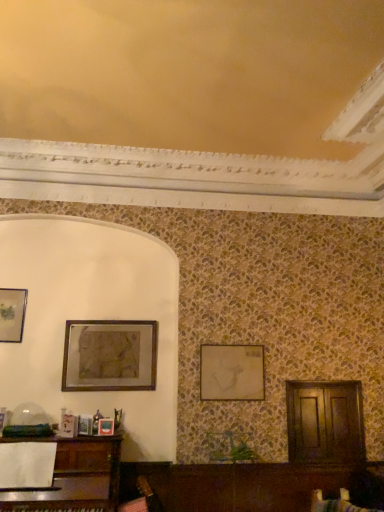
Question: Could you tell me if matte gold picture frame at center, positioned as the third picture frame in left-to-right order, is turned towards matte gold picture frame at upper left, which is counted as the first picture frame, starting from the left?

Choices:
 (A) no
 (B) yes

Answer: (A)

Question: Can you confirm if matte gold picture frame at center, positioned as the first picture frame in right-to-left order, is positioned to the left of matte gold picture frame at upper left, arranged as the third picture frame when viewed from the right?

Choices:
 (A) no
 (B) yes

Answer: (A)

Question: Are matte gold picture frame at center, positioned as the third picture frame in left-to-right order, and matte gold picture frame at upper left, which is counted as the first picture frame, starting from the left, far apart?

Choices:
 (A) no
 (B) yes

Answer: (B)

Question: From the image's perspective, does matte gold picture frame at center, positioned as the third picture frame in left-to-right order, appear higher than matte gold picture frame at upper left, arranged as the third picture frame when viewed from the right?

Choices:
 (A) no
 (B) yes

Answer: (A)

Question: From a real-world perspective, is matte gold picture frame at center, positioned as the first picture frame in right-to-left order, physically below matte gold picture frame at upper left, arranged as the third picture frame when viewed from the right?

Choices:
 (A) no
 (B) yes

Answer: (B)

Question: Can you confirm if matte gold picture frame at center, positioned as the third picture frame in left-to-right order, is shorter than matte gold picture frame at upper left, which is counted as the first picture frame, starting from the left?

Choices:
 (A) no
 (B) yes

Answer: (B)

Question: Is matte gold picture frame at upper left, which is counted as the first picture frame, starting from the left, aimed at matte gold picture frame at center, positioned as the first picture frame in right-to-left order?

Choices:
 (A) yes
 (B) no

Answer: (B)

Question: Considering the relative sizes of matte gold picture frame at upper left, arranged as the third picture frame when viewed from the right, and matte gold picture frame at center, positioned as the first picture frame in right-to-left order, in the image provided, is matte gold picture frame at upper left, arranged as the third picture frame when viewed from the right, shorter than matte gold picture frame at center, positioned as the first picture frame in right-to-left order,?

Choices:
 (A) yes
 (B) no

Answer: (B)

Question: Does matte gold picture frame at upper left, arranged as the third picture frame when viewed from the right, lie in front of matte gold picture frame at center, positioned as the third picture frame in left-to-right order?

Choices:
 (A) no
 (B) yes

Answer: (A)

Question: Considering the relative sizes of matte gold picture frame at upper left, arranged as the third picture frame when viewed from the right, and matte gold picture frame at center, positioned as the third picture frame in left-to-right order, in the image provided, is matte gold picture frame at upper left, arranged as the third picture frame when viewed from the right, smaller than matte gold picture frame at center, positioned as the third picture frame in left-to-right order,?

Choices:
 (A) yes
 (B) no

Answer: (A)

Question: Considering the relative sizes of matte gold picture frame at upper left, arranged as the third picture frame when viewed from the right, and matte gold picture frame at center, positioned as the first picture frame in right-to-left order, in the image provided, is matte gold picture frame at upper left, arranged as the third picture frame when viewed from the right, thinner than matte gold picture frame at center, positioned as the first picture frame in right-to-left order,?

Choices:
 (A) yes
 (B) no

Answer: (A)

Question: Is matte gold picture frame at upper left, which is counted as the first picture frame, starting from the left, positioned behind matte gold picture frame at center, positioned as the third picture frame in left-to-right order?

Choices:
 (A) no
 (B) yes

Answer: (B)

Question: Is matte gold picture frame at upper left, arranged as the third picture frame when viewed from the right, bigger than wooden framed artwork at upper left, which is the 2th picture frame from right to left?

Choices:
 (A) yes
 (B) no

Answer: (B)